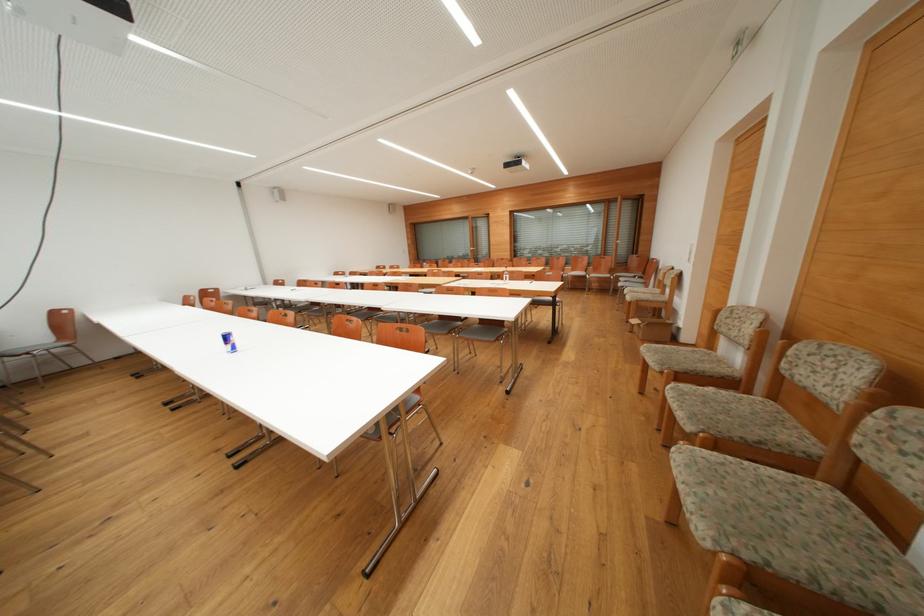
What do you see at coordinates (813, 517) in the screenshot?
I see `the chair armrest` at bounding box center [813, 517].